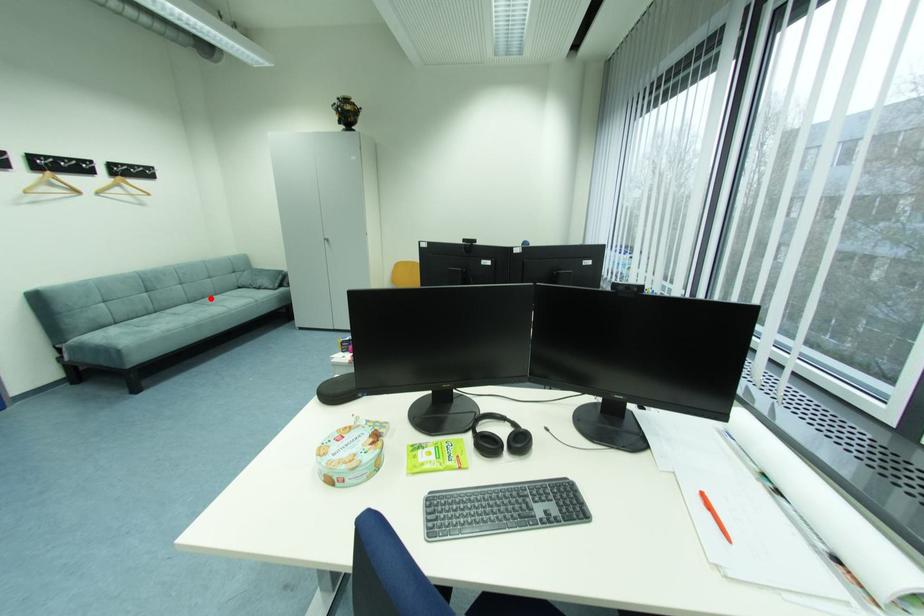
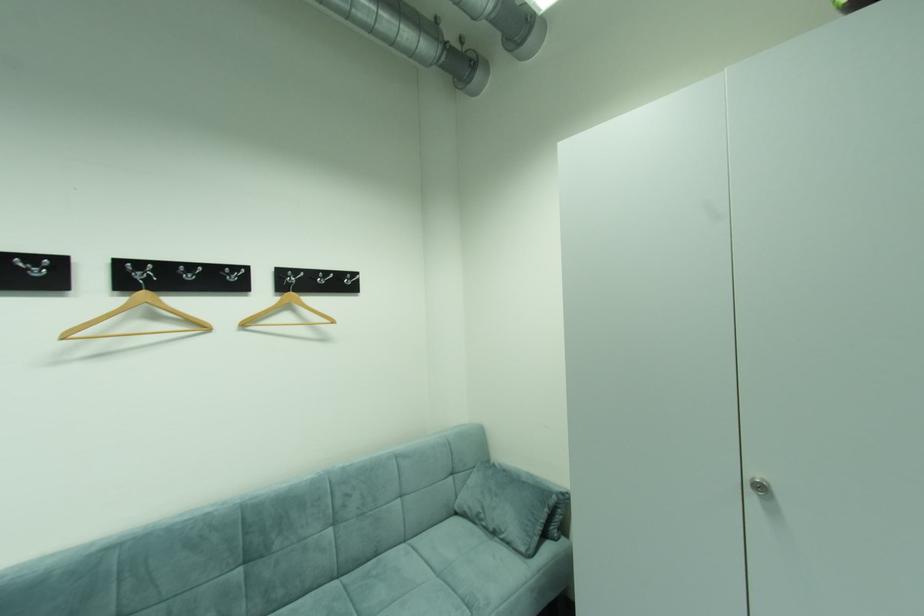
Find the pixel in the second image that matches the highlighted location in the first image.

(383, 554)